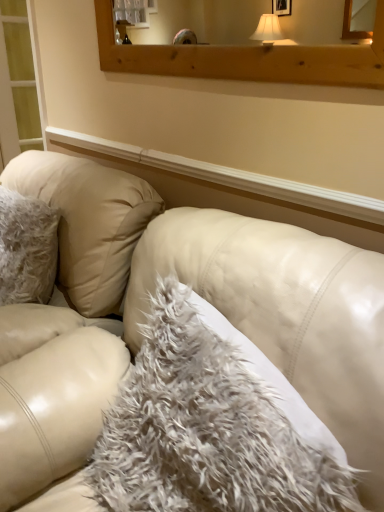
Question: Considering the relative positions of wooden frame at upper center and white leather couch at center in the image provided, is wooden frame at upper center in front of white leather couch at center?

Choices:
 (A) yes
 (B) no

Answer: (B)

Question: Can white leather couch at center be found inside wooden frame at upper center?

Choices:
 (A) no
 (B) yes

Answer: (A)

Question: Is wooden frame at upper center facing away from white leather couch at center?

Choices:
 (A) no
 (B) yes

Answer: (A)

Question: Would you consider wooden frame at upper center to be distant from white leather couch at center?

Choices:
 (A) yes
 (B) no

Answer: (B)

Question: Is wooden frame at upper center oriented towards white leather couch at center?

Choices:
 (A) yes
 (B) no

Answer: (B)

Question: Relative to white fluffy pillow at center, is wooden frame at upper center in front or behind?

Choices:
 (A) behind
 (B) front

Answer: (A)

Question: Is point (117, 58) closer or farther from the camera than point (175, 460)?

Choices:
 (A) farther
 (B) closer

Answer: (A)

Question: From the image's perspective, is wooden frame at upper center located above or below white fluffy pillow at center?

Choices:
 (A) above
 (B) below

Answer: (A)

Question: Is wooden frame at upper center inside or outside of white fluffy pillow at center?

Choices:
 (A) inside
 (B) outside

Answer: (B)

Question: In the image, is white fluffy pillow at center positioned in front of or behind wooden frame at upper center?

Choices:
 (A) front
 (B) behind

Answer: (A)

Question: Would you say white fluffy pillow at center is to the left or to the right of wooden frame at upper center in the picture?

Choices:
 (A) right
 (B) left

Answer: (B)

Question: Considering the positions of point (190, 380) and point (374, 87), is point (190, 380) closer or farther from the camera than point (374, 87)?

Choices:
 (A) closer
 (B) farther

Answer: (A)

Question: From their relative heights in the image, would you say white fluffy pillow at center is taller or shorter than wooden frame at upper center?

Choices:
 (A) short
 (B) tall

Answer: (B)

Question: In the image, is white leather couch at center on the left side or the right side of wooden frame at upper center?

Choices:
 (A) right
 (B) left

Answer: (B)

Question: From their relative heights in the image, would you say white leather couch at center is taller or shorter than wooden frame at upper center?

Choices:
 (A) tall
 (B) short

Answer: (A)